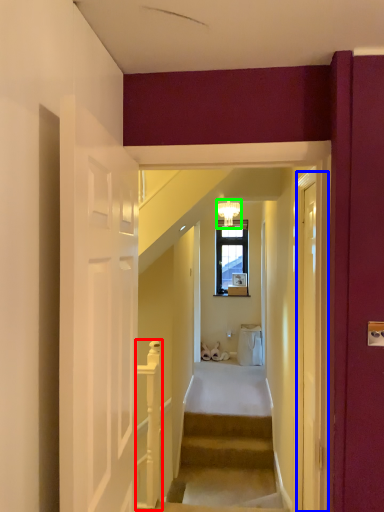
Question: Based on their relative distances, which object is farther from rail (highlighted by a red box)? Choose from glass door (highlighted by a blue box) and light fixture (highlighted by a green box).

Choices:
 (A) glass door
 (B) light fixture

Answer: (B)